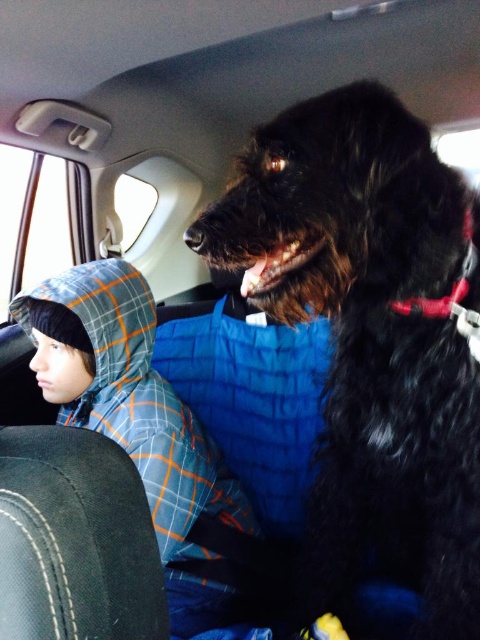
Question: Which object is farther from the camera taking this photo?

Choices:
 (A) black shaggy dog at upper right
 (B) blue plaid jacket at center

Answer: (B)

Question: From the image, what is the correct spatial relationship of black shaggy dog at upper right in relation to blue plaid jacket at center?

Choices:
 (A) below
 (B) above

Answer: (B)

Question: Is black shaggy dog at upper right bigger than blue plaid jacket at center?

Choices:
 (A) yes
 (B) no

Answer: (A)

Question: Is black shaggy dog at upper right bigger than blue plaid jacket at center?

Choices:
 (A) yes
 (B) no

Answer: (A)

Question: Which point is closer to the camera?

Choices:
 (A) (406, 365)
 (B) (120, 403)

Answer: (A)